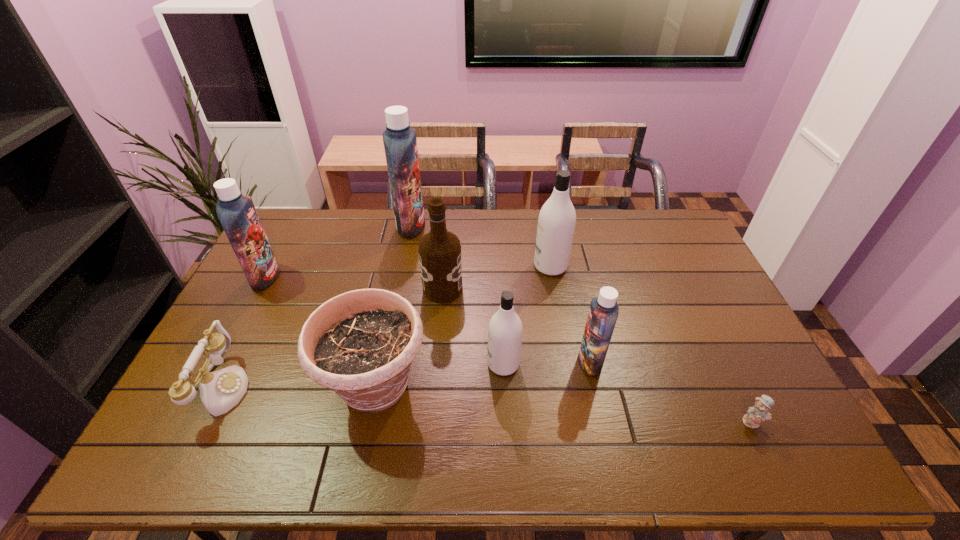
Find the location of a particular element. The width and height of the screenshot is (960, 540). the left white shampoo is located at coordinates (x=505, y=327).

Find the location of a particular element. The image size is (960, 540). flowerpot is located at coordinates (361, 344).

You are a GUI agent. You are given a task and a screenshot of the screen. Output one action in this format:
    pyautogui.click(x=<x>, y=<y>)
    Task: Click on the telephone
    
    Given the screenshot: What is the action you would take?
    pyautogui.click(x=220, y=391)

At what (x,y) coordinates should I click in order to perform the action: click on white telephone. Please return your answer as a coordinate pair (x, y). Looking at the image, I should click on (220, 391).

Find the location of a particular element. The width and height of the screenshot is (960, 540). the shortest object is located at coordinates (759, 411).

What are the coordinates of `blue teddy bear` in the screenshot? It's located at (759, 411).

This screenshot has width=960, height=540. Identify the location of blank area located on the front label of the second shampoo from left to right. (438, 225).

Identify the location of vacant space positioned 0.290m on the front label of the leftmost shampoo. (365, 277).

In order to click on vacant space located 0.170m on the front-facing side of the farther white shampoo in this screenshot , I will do `click(484, 266)`.

This screenshot has width=960, height=540. Find the location of `free region located on the front-facing side of the farther white shampoo`. free region located on the front-facing side of the farther white shampoo is located at coordinates (452, 266).